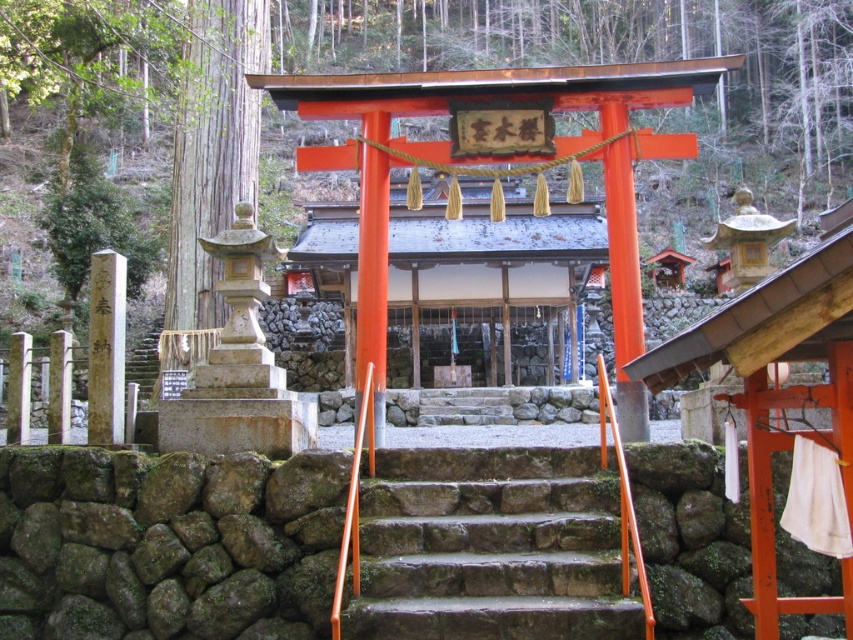
Question: Observing the image, what is the correct spatial positioning of orange glossy torii gate at center in reference to brown stone pillar at left?

Choices:
 (A) left
 (B) right

Answer: (B)

Question: Among these points, which one is nearest to the camera?

Choices:
 (A) (358, 317)
 (B) (112, 330)

Answer: (B)

Question: Considering the relative positions of orange glossy torii gate at center and brown stone pillar at left in the image provided, where is orange glossy torii gate at center located with respect to brown stone pillar at left?

Choices:
 (A) above
 (B) below

Answer: (A)

Question: Estimate the real-world distances between objects in this image. Which object is closer to the brown stone pillar at left?

Choices:
 (A) orange glossy torii gate at center
 (B) mossy stone stairs at center

Answer: (A)

Question: Does orange glossy torii gate at center have a larger size compared to brown stone pillar at left?

Choices:
 (A) no
 (B) yes

Answer: (A)

Question: Among these objects, which one is nearest to the camera?

Choices:
 (A) orange glossy torii gate at center
 (B) brown stone pillar at left

Answer: (A)